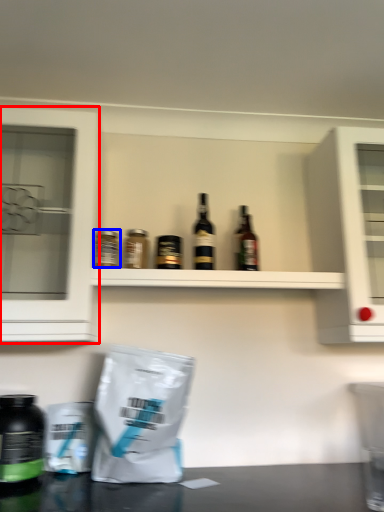
Question: Which object appears closest to the camera in this image, cabinetry (highlighted by a red box) or bottle (highlighted by a blue box)?

Choices:
 (A) cabinetry
 (B) bottle

Answer: (A)